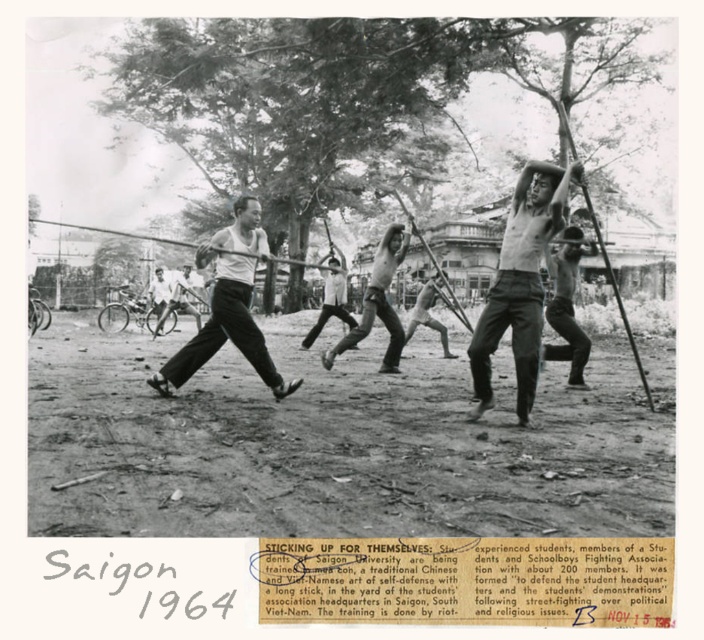
Question: Where is shiny black pants at center located in relation to white cotton tank top at center in the image?

Choices:
 (A) below
 (B) above

Answer: (B)

Question: Which object appears closest to the camera in this image?

Choices:
 (A) smooth skin man at center
 (B) shiny black pants at center
 (C) light gray cotton shirt at center

Answer: (B)

Question: Which of the following is the farthest from the observer?

Choices:
 (A) light gray cotton shirt at center
 (B) shiny black pants at center

Answer: (A)

Question: Which point is farther to the camera?

Choices:
 (A) light gray cotton shirt at center
 (B) white cotton tank top at center
 (C) dirt field at center
 (D) smooth skin man at center

Answer: (A)

Question: Is white cotton tank top at center thinner than light gray cotton shirt at center?

Choices:
 (A) yes
 (B) no

Answer: (A)

Question: Can you confirm if shiny black pants at center is smaller than light gray cotton shirt at center?

Choices:
 (A) no
 (B) yes

Answer: (B)